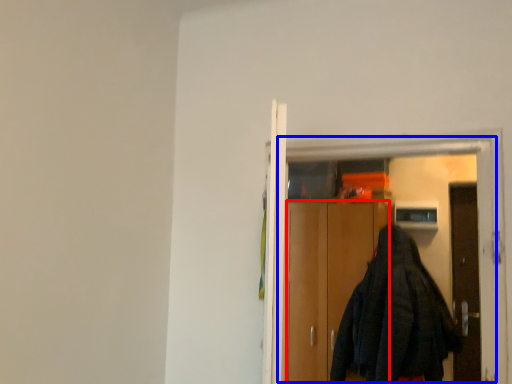
Question: Which point is closer to the camera, cabinetry (highlighted by a red box) or elevator (highlighted by a blue box)?

Choices:
 (A) cabinetry
 (B) elevator

Answer: (B)